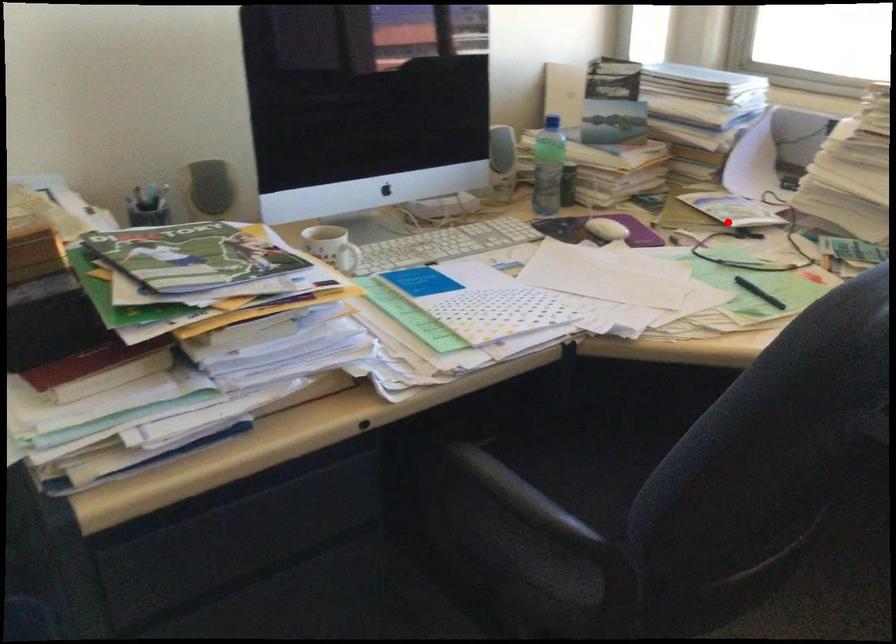
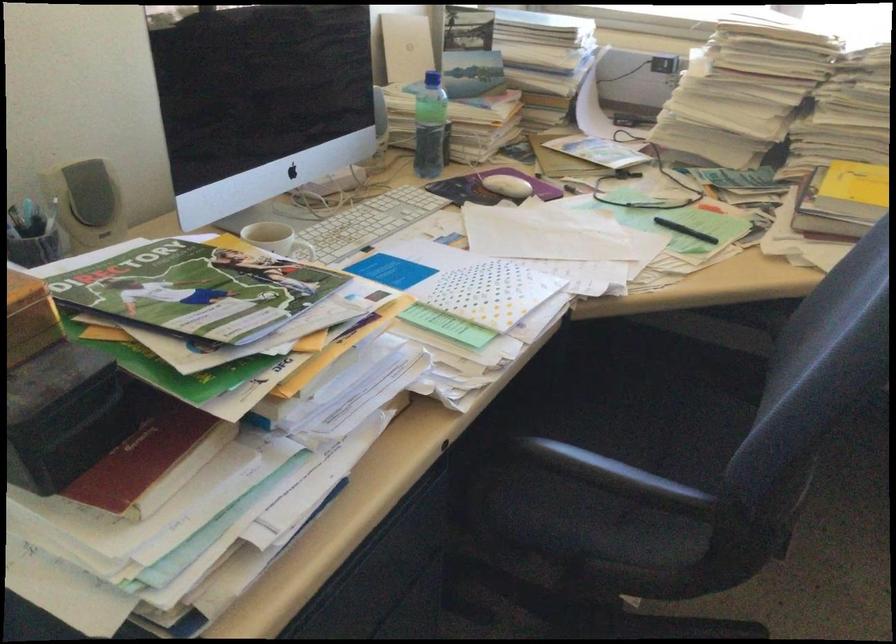
In the second image, find the point that corresponds to the highlighted location in the first image.

(610, 166)